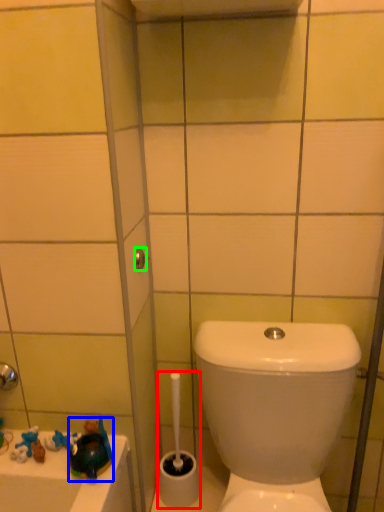
Question: Estimate the real-world distances between objects in this image. Which object is farther from brush (highlighted by a red box), toy (highlighted by a blue box) or shower (highlighted by a green box)?

Choices:
 (A) toy
 (B) shower

Answer: (B)